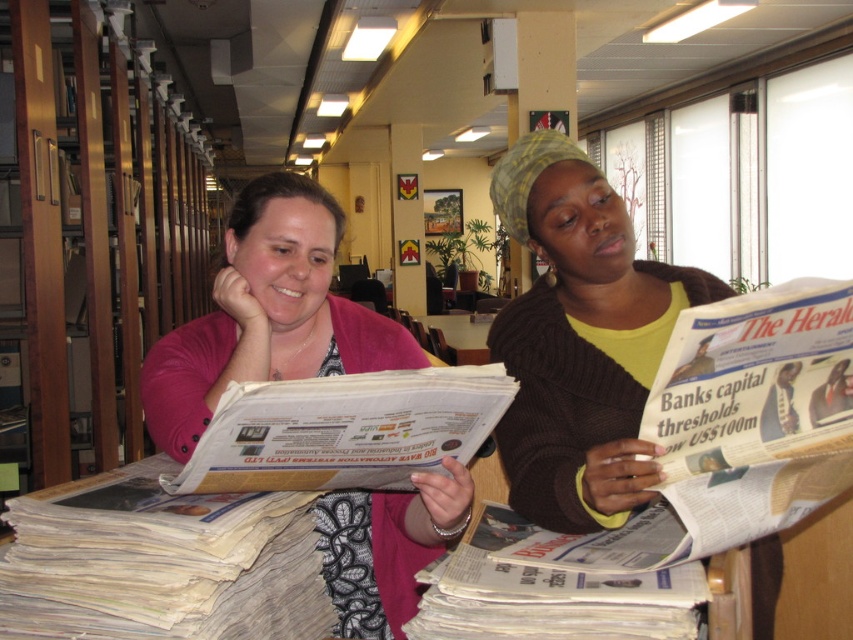
What is the location of the point with coordinates (579, 339) in the image?

The point with coordinates (579, 339) is located on the brown knitted sweater at center.

You are a tailor who needs to create a new garment. You observe the brown knitted sweater at center and the pink fabric at center. Which item has a smaller width, and why?

The brown knitted sweater at center has a smaller width than the pink fabric at center because the brown knitted sweater at center is narrower than the pink fabric at center according to the description.